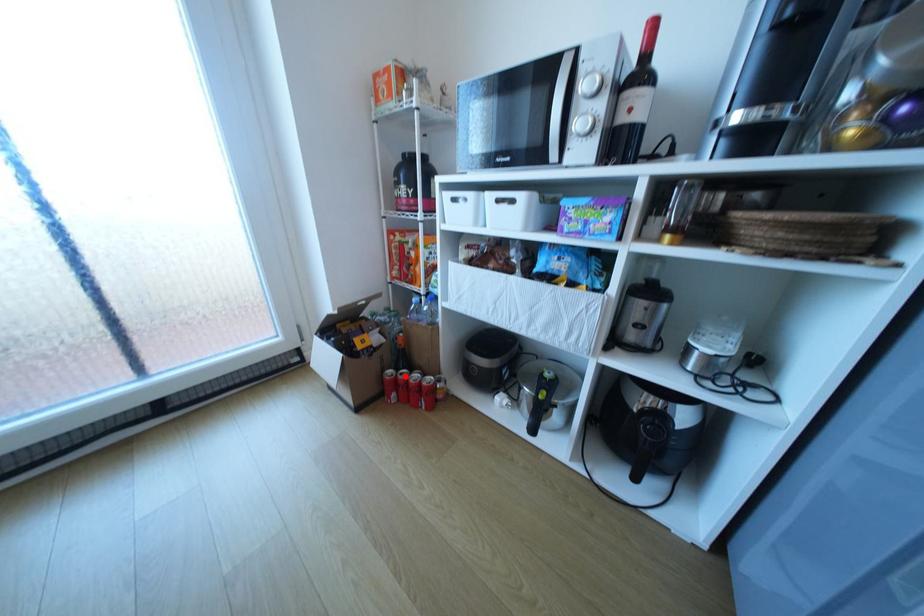
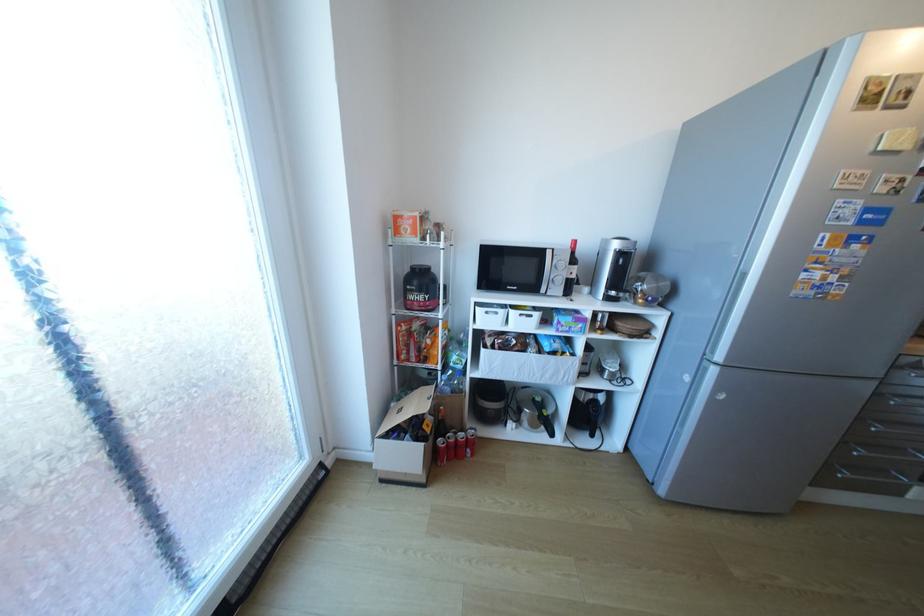
Where in the second image is the point corresponding to the highlighted location from the first image?

(456, 442)